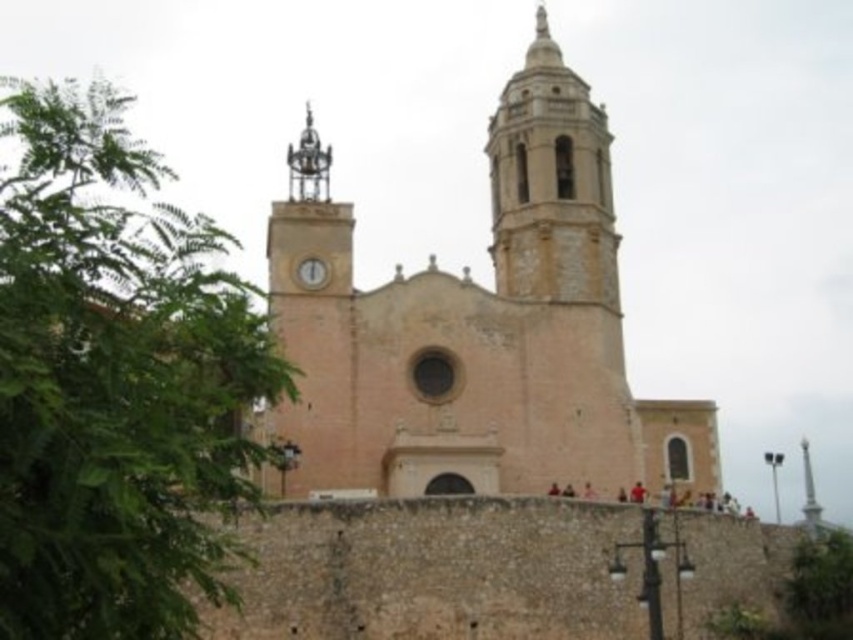
Question: Which is nearer to the beige stone church at center?

Choices:
 (A) green leafy tree at left
 (B) white glossy clock at center

Answer: (B)

Question: Estimate the real-world distances between objects in this image. Which object is closer to the beige stone church at center?

Choices:
 (A) white glossy clock at center
 (B) green leafy tree at left
 (C) smooth beige bell tower at upper center

Answer: (C)

Question: Which of the following is the closest to the observer?

Choices:
 (A) beige stone church at center
 (B) smooth beige bell tower at upper center
 (C) white glossy clock at center

Answer: (A)

Question: Is green leafy tree at left smaller than smooth beige bell tower at upper center?

Choices:
 (A) no
 (B) yes

Answer: (A)

Question: Does green leafy tree at left appear on the right side of smooth beige bell tower at upper center?

Choices:
 (A) no
 (B) yes

Answer: (A)

Question: Does beige stone church at center have a lesser width compared to white glossy clock at center?

Choices:
 (A) yes
 (B) no

Answer: (B)